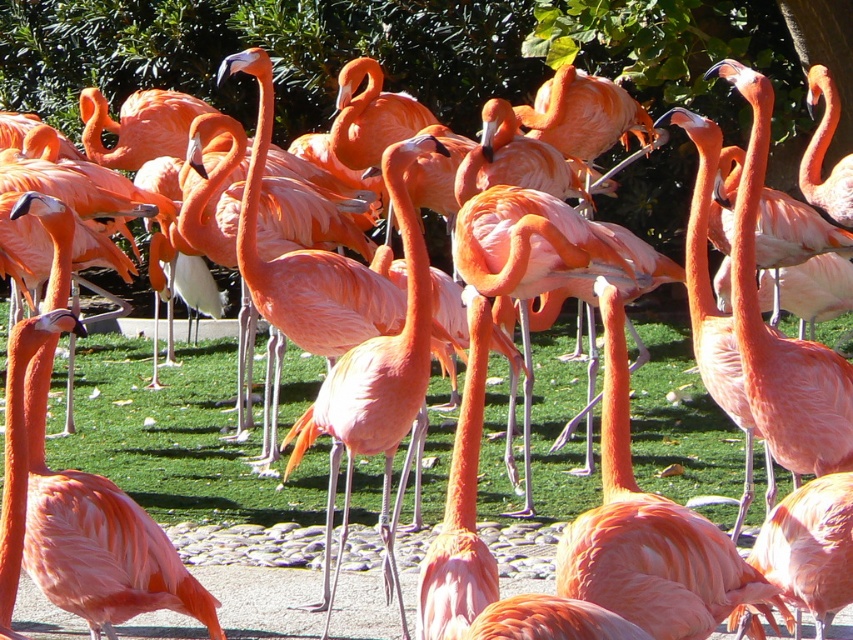
Question: Does green grass at center appear on the left side of matte pink flamingo at center?

Choices:
 (A) yes
 (B) no

Answer: (B)

Question: Can you confirm if green grass at center is positioned to the left of matte pink flamingo at center?

Choices:
 (A) no
 (B) yes

Answer: (A)

Question: Which point is closer to the camera?

Choices:
 (A) (316, 474)
 (B) (20, 321)

Answer: (B)

Question: Among these objects, which one is nearest to the camera?

Choices:
 (A) green grass at center
 (B) matte pink flamingo at center

Answer: (B)

Question: Is green grass at center positioned before matte pink flamingo at center?

Choices:
 (A) no
 (B) yes

Answer: (A)